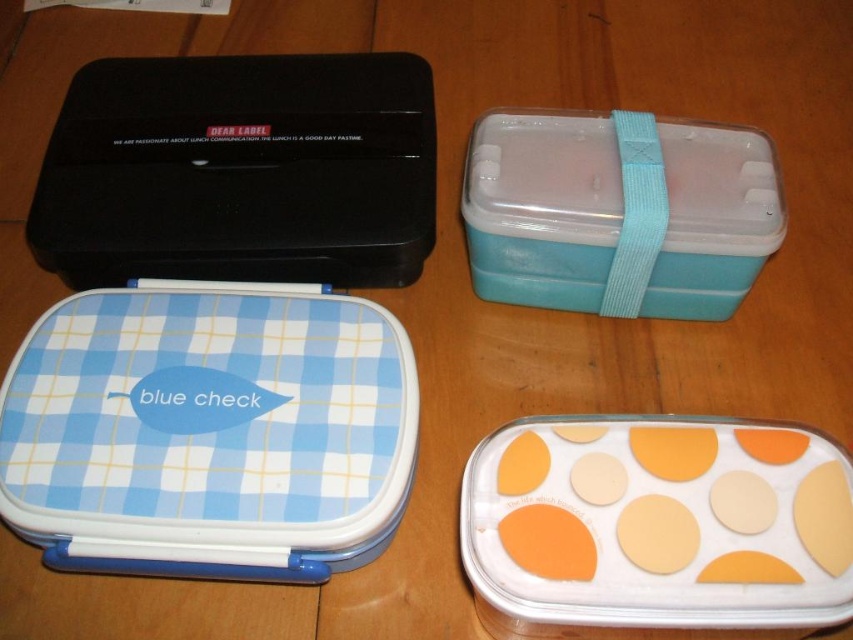
Question: Does black plastic lunch box at upper left appear on the right side of teal plastic lunchbox at upper right?

Choices:
 (A) no
 (B) yes

Answer: (A)

Question: Which object is positioned closest to the black plastic lunch box at upper left?

Choices:
 (A) matte orange and white plastic container at lower right
 (B) teal plastic lunchbox at upper right

Answer: (B)

Question: Is blue checkered lunchbox at center below matte orange and white plastic container at lower right?

Choices:
 (A) yes
 (B) no

Answer: (B)

Question: Estimate the real-world distances between objects in this image. Which object is closer to the matte orange and white plastic container at lower right?

Choices:
 (A) teal plastic lunchbox at upper right
 (B) blue checkered lunchbox at center

Answer: (A)

Question: Which of these objects is positioned closest to the teal plastic lunchbox at upper right?

Choices:
 (A) blue checkered lunchbox at center
 (B) black plastic lunch box at upper left

Answer: (B)

Question: Does blue checkered lunchbox at center have a greater width compared to matte orange and white plastic container at lower right?

Choices:
 (A) yes
 (B) no

Answer: (A)